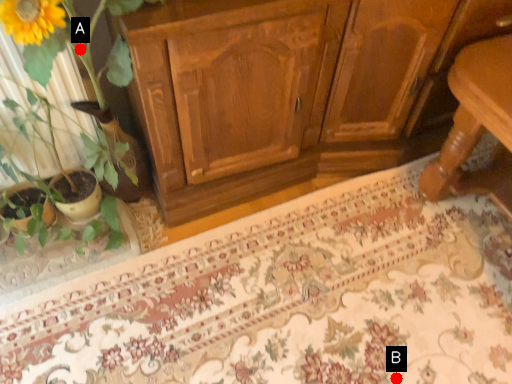
Question: Two points are circled on the image, labeled by A and B beside each circle. Which of the following is the farthest from the observer?

Choices:
 (A) A is further
 (B) B is further

Answer: (B)